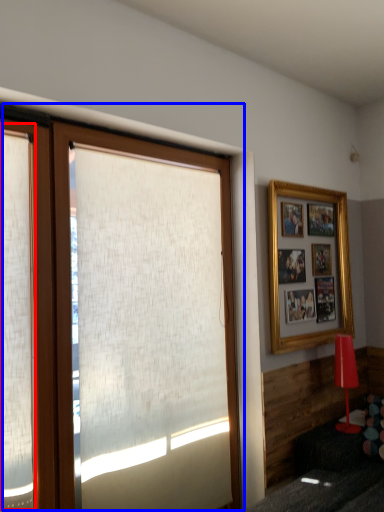
Question: Which point is closer to the camera, shutter (highlighted by a red box) or window (highlighted by a blue box)?

Choices:
 (A) shutter
 (B) window

Answer: (A)